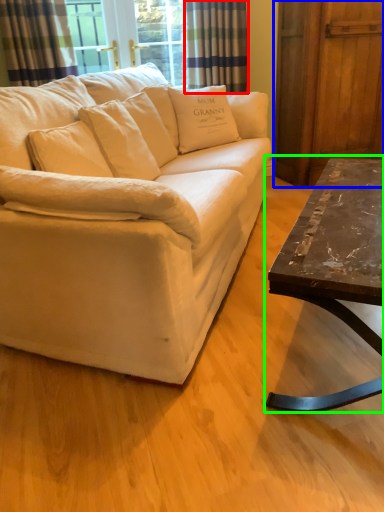
Question: Based on their relative distances, which object is nearer to curtain (highlighted by a red box)? Choose from barn door (highlighted by a blue box) and coffee table (highlighted by a green box).

Choices:
 (A) barn door
 (B) coffee table

Answer: (A)